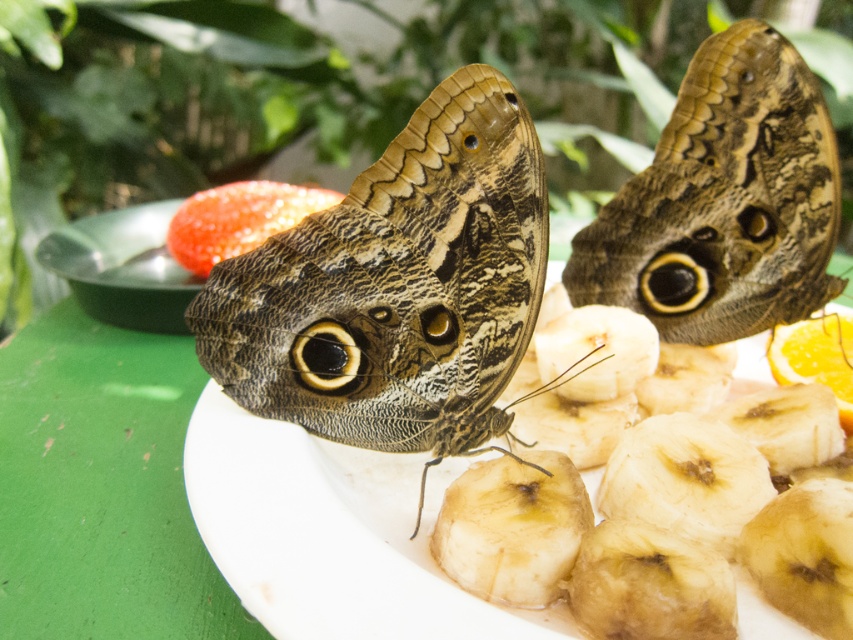
Question: Which of these objects is positioned closest to the smooth white plate at center?

Choices:
 (A) brown textured butterfly at center
 (B) camouflage-patterned butterfly at upper right

Answer: (A)

Question: Is camouflage-patterned butterfly at upper right below smooth white plate at center?

Choices:
 (A) yes
 (B) no

Answer: (B)

Question: Is brown textured butterfly at center smaller than smooth white plate at center?

Choices:
 (A) no
 (B) yes

Answer: (B)

Question: Does camouflage-patterned butterfly at upper right lie behind orangesmoothfruit at right?

Choices:
 (A) yes
 (B) no

Answer: (B)

Question: Which object is closer to the camera taking this photo?

Choices:
 (A) brown textured butterfly at center
 (B) orangesmoothfruit at right
 (C) smooth white plate at center
 (D) camouflage-patterned butterfly at upper right

Answer: (C)

Question: Which point is closer to the camera?

Choices:
 (A) (654, 225)
 (B) (322, 372)
 (C) (827, 358)
 (D) (554, 268)

Answer: (B)